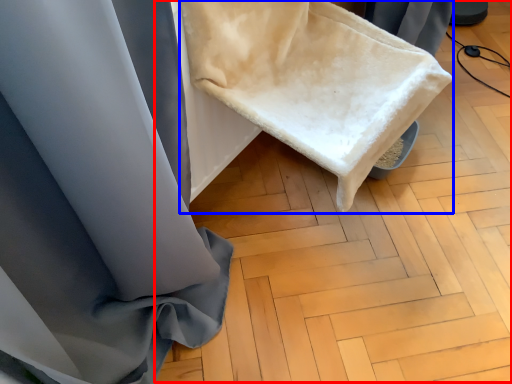
Question: Among these objects, which one is farthest to the camera, wood (highlighted by a red box) or wide (highlighted by a blue box)?

Choices:
 (A) wood
 (B) wide

Answer: (A)